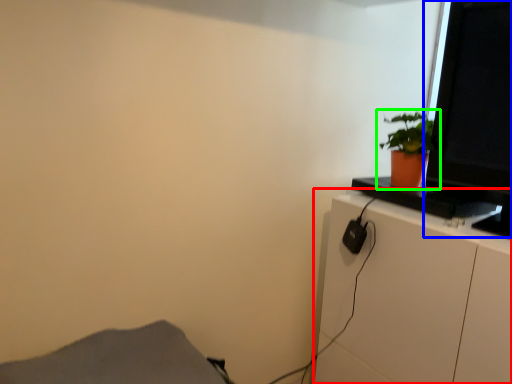
Question: Based on their relative distances, which object is farther from cabinetry (highlighted by a red box)? Choose from computer monitor (highlighted by a blue box) and houseplant (highlighted by a green box).

Choices:
 (A) computer monitor
 (B) houseplant

Answer: (B)